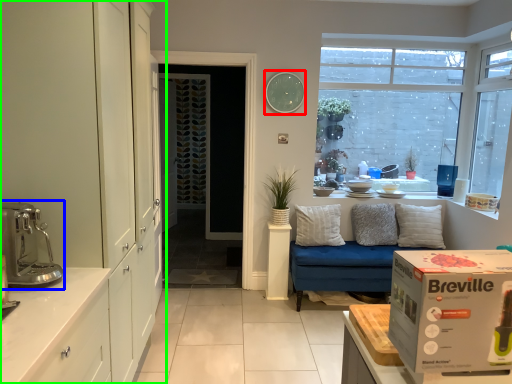
Question: Considering the real-world distances, which object is closest to clock (highlighted by a red box)? coffee machine (highlighted by a blue box) or dresser (highlighted by a green box).

Choices:
 (A) coffee machine
 (B) dresser

Answer: (B)